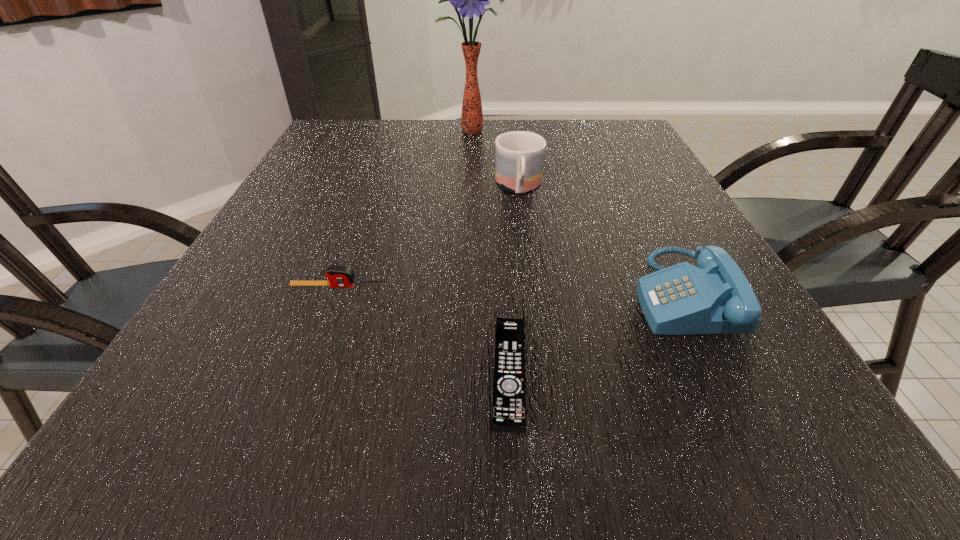
You are a GUI agent. You are given a task and a screenshot of the screen. Output one action in this format:
    pyautogui.click(x=<x>, y=<y>)
    Task: Click on the blank space at the near edge of the desktop
    The image size is (960, 540).
    Given the screenshot: What is the action you would take?
    pyautogui.click(x=408, y=433)

The image size is (960, 540). In the image, there is a desktop. In order to click on vacant space at the left edge in this screenshot , I will do `click(190, 337)`.

The height and width of the screenshot is (540, 960). In order to click on vacant area at the right edge in this screenshot , I will do `click(628, 179)`.

In the image, there is a desktop. At what (x,y) coordinates should I click in order to perform the action: click on vacant area at the far left corner. Please return your answer as a coordinate pair (x, y). Looking at the image, I should click on (372, 127).

Where is `blank space at the near right corner of the desktop`? This screenshot has width=960, height=540. blank space at the near right corner of the desktop is located at coordinates (708, 421).

Where is `unoccupied area between the remote control and the farthest object`? unoccupied area between the remote control and the farthest object is located at coordinates (491, 252).

This screenshot has width=960, height=540. I want to click on free space between the flower arrangement and the remote control, so click(491, 252).

This screenshot has width=960, height=540. What are the coordinates of `unoccupied position between the shortest object and the mug` in the screenshot? It's located at (514, 280).

You are a GUI agent. You are given a task and a screenshot of the screen. Output one action in this format:
    pyautogui.click(x=<x>, y=<y>)
    Task: Click on the free spot between the remote control and the second shortest object
    
    Given the screenshot: What is the action you would take?
    pyautogui.click(x=424, y=329)

Locate an element on the screen. free point between the second farthest object and the leftmost object is located at coordinates (429, 238).